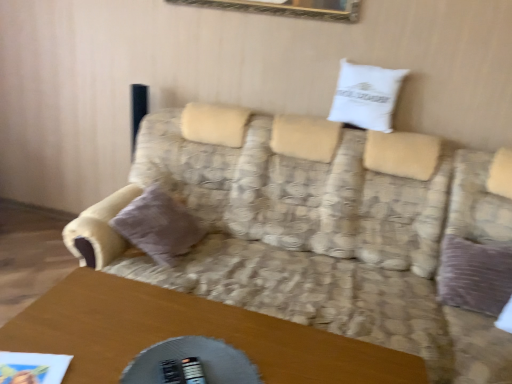
Question: Is wooden table at lower center oriented towards white cotton pillow at upper center, the first pillow when ordered from right to left?

Choices:
 (A) yes
 (B) no

Answer: (B)

Question: Considering the relative sizes of wooden table at lower center and white cotton pillow at upper center, which appears as the first pillow when viewed from the top, in the image provided, is wooden table at lower center smaller than white cotton pillow at upper center, which appears as the first pillow when viewed from the top,?

Choices:
 (A) yes
 (B) no

Answer: (B)

Question: From the image's perspective, is wooden table at lower center under white cotton pillow at upper center, marked as the 2th pillow in a left-to-right arrangement?

Choices:
 (A) no
 (B) yes

Answer: (B)

Question: Considering the relative sizes of wooden table at lower center and white cotton pillow at upper center, which appears as the first pillow when viewed from the top, in the image provided, is wooden table at lower center thinner than white cotton pillow at upper center, which appears as the first pillow when viewed from the top,?

Choices:
 (A) no
 (B) yes

Answer: (A)

Question: Is wooden table at lower center next to white cotton pillow at upper center, the first pillow when ordered from right to left, and touching it?

Choices:
 (A) yes
 (B) no

Answer: (B)

Question: Considering the positions of point (487, 165) and point (388, 94), is point (487, 165) closer or farther from the camera than point (388, 94)?

Choices:
 (A) closer
 (B) farther

Answer: (A)

Question: Considering their positions, is patterned fabric couch at center located in front of or behind white cotton pillow at upper center, the first pillow when ordered from right to left?

Choices:
 (A) front
 (B) behind

Answer: (A)

Question: Looking at the image, does patterned fabric couch at center seem bigger or smaller compared to white cotton pillow at upper center, marked as the 2th pillow in a left-to-right arrangement?

Choices:
 (A) big
 (B) small

Answer: (A)

Question: From a real-world perspective, is patterned fabric couch at center above or below white cotton pillow at upper center, which is the 2th pillow in bottom-to-top order?

Choices:
 (A) above
 (B) below

Answer: (B)

Question: In the image, is wooden table at lower center positioned in front of or behind velvet purple pillow at left, which is counted as the 2th pillow, starting from the right?

Choices:
 (A) front
 (B) behind

Answer: (A)

Question: Choose the correct answer: Is wooden table at lower center inside velvet purple pillow at left, which is counted as the 2th pillow, starting from the right, or outside it?

Choices:
 (A) outside
 (B) inside

Answer: (A)

Question: From a real-world perspective, is wooden table at lower center physically located above or below velvet purple pillow at left, which is counted as the 2th pillow, starting from the top?

Choices:
 (A) below
 (B) above

Answer: (A)

Question: From the image's perspective, is wooden table at lower center positioned above or below velvet purple pillow at left, marked as the first pillow in a bottom-to-top arrangement?

Choices:
 (A) below
 (B) above

Answer: (A)

Question: Would you say wooden table at lower center is inside or outside white cotton pillow at upper center, which is the 2th pillow in bottom-to-top order?

Choices:
 (A) inside
 (B) outside

Answer: (B)

Question: Visually, is wooden table at lower center positioned to the left or to the right of white cotton pillow at upper center, which is the 2th pillow in bottom-to-top order?

Choices:
 (A) left
 (B) right

Answer: (A)